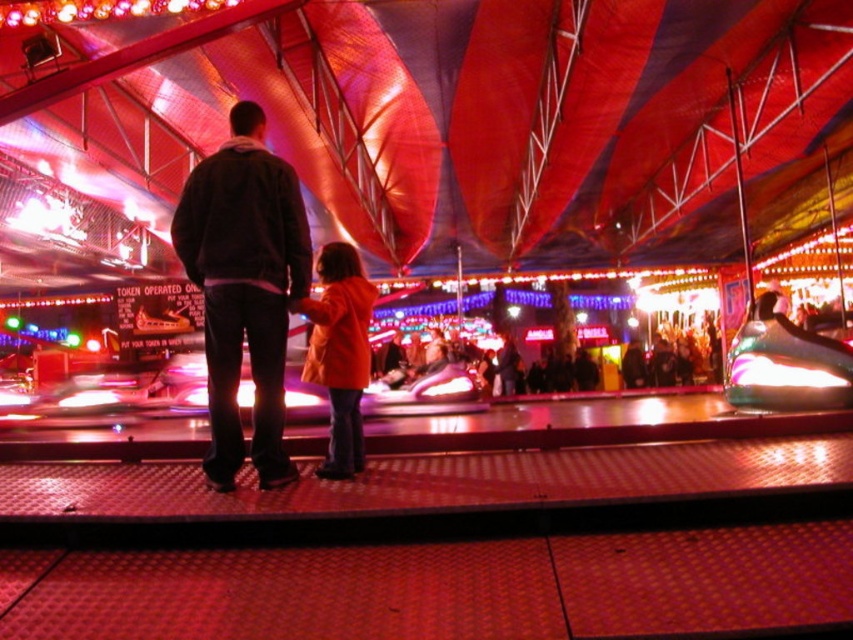
You are standing at the fairground and want to reach a specific point marked at coordinates point (229, 168). If you can walk 5 meters in one minute, how long will it take you to reach that point?

The distance of point (229, 168) from viewer is 4.45 meters. At a walking speed of 5 meters per minute, it would take approximately 0.89 minutes, which is roughly 53 seconds, to reach the point.

You are a photographer at the fairground and want to capture both the dark gray hoodie at center and the orange matte coat at center in a single frame. Given that your camera has a fixed focal length, which person should you position closer to the camera to ensure both appear equally sized in the photo?

Since the dark gray hoodie at center is larger in size than the orange matte coat at center, you should position the orange matte coat at center closer to the camera. This way, the smaller orange matte coat at center will appear larger in the photo, balancing its size with the larger dark gray hoodie at center.

You are standing at the entrance of the fairground and want to find the dark gray hoodie at center. According to the coordinates provided, in which direction should you look to locate it?

The dark gray hoodie at center is located at coordinates point (244, 288), so you should look towards the center slightly to the right and lower middle area to locate it.